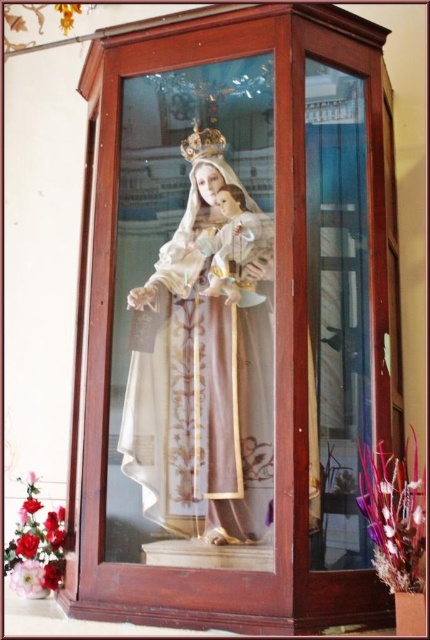
Does matte gold robe at center have a greater height compared to gold metallic crown at upper center?

Yes, matte gold robe at center is taller than gold metallic crown at upper center.

Between matte gold robe at center and gold metallic crown at upper center, which one appears on the right side from the viewer's perspective?

matte gold robe at center

Between point (217, 180) and point (205, 138), which one is positioned in front?

Positioned in front is point (217, 180).

Locate an element on the screen. Image resolution: width=430 pixels, height=640 pixels. matte gold robe at center is located at coordinates (199, 388).